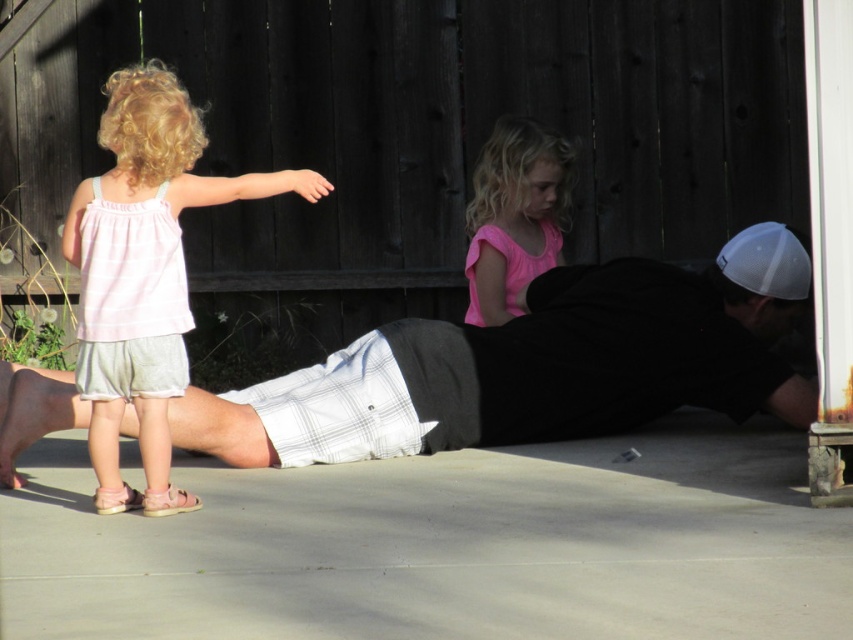
Between white plaid shirt at center and pink fabric dress at left, which one appears on the left side from the viewer's perspective?

From the viewer's perspective, pink fabric dress at left appears more on the left side.

From the picture: Who is taller, white plaid shirt at center or pink fabric dress at left?

pink fabric dress at left

Describe the element at coordinates (532, 365) in the screenshot. I see `white plaid shirt at center` at that location.

Locate an element on the screen. The image size is (853, 640). white plaid shirt at center is located at coordinates click(x=532, y=365).

Between point (541, 272) and point (126, 499), which one is positioned in front?

Point (126, 499)

You are a GUI agent. You are given a task and a screenshot of the screen. Output one action in this format:
    pyautogui.click(x=<x>, y=<y>)
    Task: Click on the pink fabric shirt at center
    The height and width of the screenshot is (640, 853).
    Given the screenshot: What is the action you would take?
    pyautogui.click(x=514, y=216)

Is white plaid shirt at center thinner than pink fabric shirt at center?

Incorrect, white plaid shirt at center's width is not less than pink fabric shirt at center's.

Is white plaid shirt at center shorter than pink fabric shirt at center?

Incorrect, white plaid shirt at center's height does not fall short of pink fabric shirt at center's.

Which is in front, point (776, 225) or point (546, 218)?

Point (776, 225)

The height and width of the screenshot is (640, 853). Identify the location of white plaid shirt at center. (532, 365).